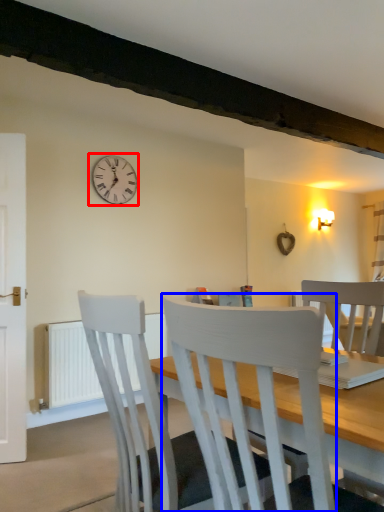
Question: Which point is further to the camera, wall clock (highlighted by a red box) or chair (highlighted by a blue box)?

Choices:
 (A) wall clock
 (B) chair

Answer: (A)